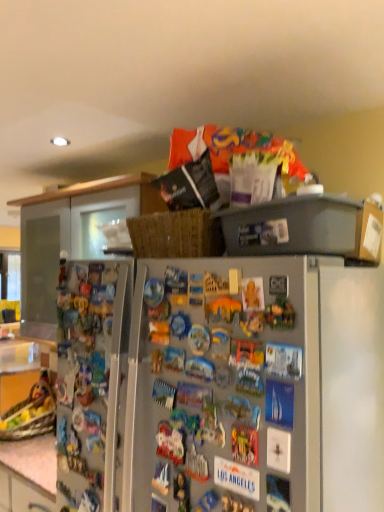
Question: Does matte wood cabinet at upper center appear on the left side of satin silver refrigerator at center?

Choices:
 (A) no
 (B) yes

Answer: (B)

Question: From the image's perspective, is matte wood cabinet at upper center beneath satin silver refrigerator at center?

Choices:
 (A) no
 (B) yes

Answer: (A)

Question: Does matte wood cabinet at upper center have a lesser height compared to satin silver refrigerator at center?

Choices:
 (A) no
 (B) yes

Answer: (B)

Question: Does matte wood cabinet at upper center have a larger size compared to satin silver refrigerator at center?

Choices:
 (A) yes
 (B) no

Answer: (B)

Question: Does matte wood cabinet at upper center come behind satin silver refrigerator at center?

Choices:
 (A) no
 (B) yes

Answer: (B)

Question: Is matte wood cabinet at upper center facing towards satin silver refrigerator at center?

Choices:
 (A) yes
 (B) no

Answer: (B)

Question: From the image's perspective, is satin silver refrigerator at center beneath matte wood cabinet at upper center?

Choices:
 (A) yes
 (B) no

Answer: (A)

Question: Is satin silver refrigerator at center positioned with its back to matte wood cabinet at upper center?

Choices:
 (A) yes
 (B) no

Answer: (A)

Question: From the image's perspective, does satin silver refrigerator at center appear higher than matte wood cabinet at upper center?

Choices:
 (A) yes
 (B) no

Answer: (B)

Question: Is satin silver refrigerator at center to the left of matte wood cabinet at upper center from the viewer's perspective?

Choices:
 (A) yes
 (B) no

Answer: (B)

Question: Does satin silver refrigerator at center have a smaller size compared to matte wood cabinet at upper center?

Choices:
 (A) yes
 (B) no

Answer: (B)

Question: Could you tell me if satin silver refrigerator at center is turned towards matte wood cabinet at upper center?

Choices:
 (A) no
 (B) yes

Answer: (B)

Question: Visually, is matte wood cabinet at upper center positioned to the left or to the right of satin silver refrigerator at center?

Choices:
 (A) right
 (B) left

Answer: (B)